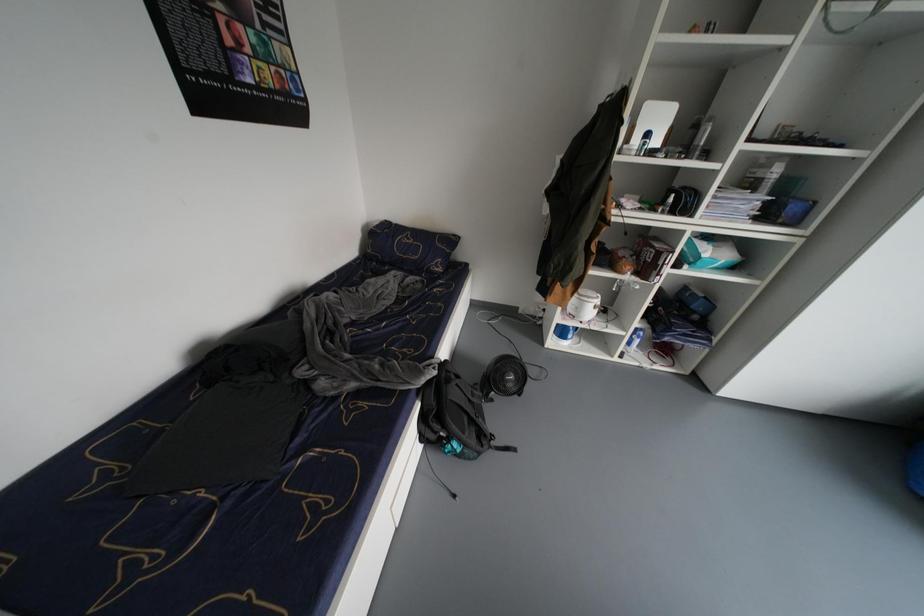
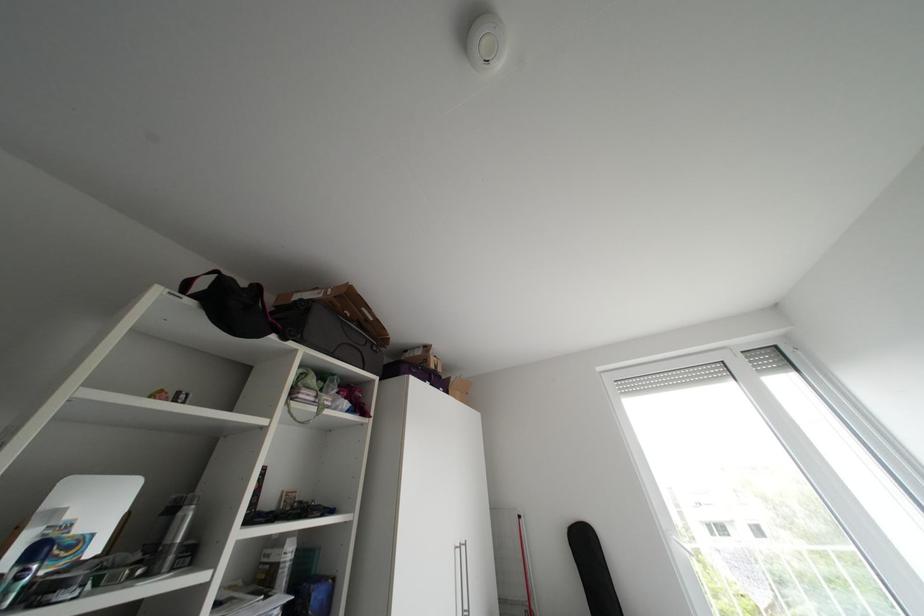
First-person continuous shooting, in which direction is the camera rotating?

The camera rotated toward right-up.